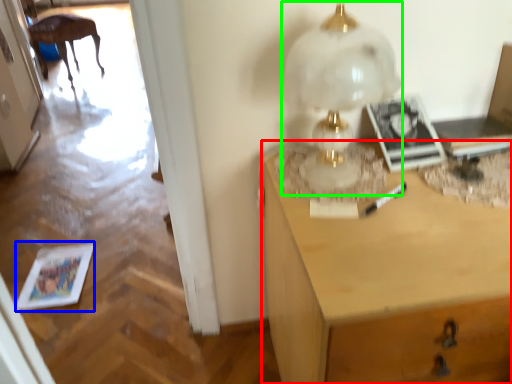
Question: Which is farther away from desk (highlighted by a red box)? magazine (highlighted by a blue box) or table lamp (highlighted by a green box)?

Choices:
 (A) magazine
 (B) table lamp

Answer: (A)